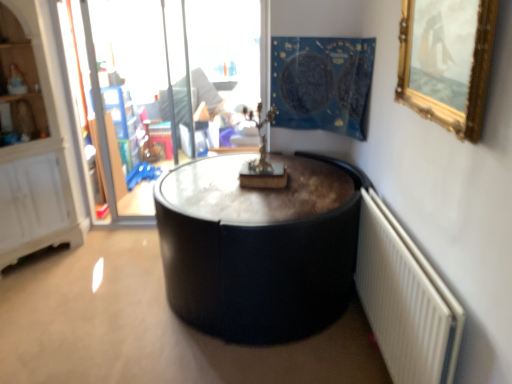
Identify the location of white textured radiator at lower right. The height and width of the screenshot is (384, 512). (405, 300).

In order to click on transparent glass door at upper left in this screenshot , I will do `click(178, 61)`.

Locate an element on the screen. This screenshot has height=384, width=512. white textured radiator at lower right is located at coordinates (405, 300).

From the image's perspective, does transparent glass door at upper left appear higher than white textured radiator at lower right?

Indeed, from the image's perspective, transparent glass door at upper left is shown above white textured radiator at lower right.

In the image, is transparent glass door at upper left on the left side or the right side of white textured radiator at lower right?

transparent glass door at upper left is positioned on white textured radiator at lower right's left side.

From a real-world perspective, which object stands above the other?

transparent glass door at upper left, from a real-world perspective.

Which of these two, blue fabric tapestry at upper center or gold-framed mirror at upper right, is smaller?

gold-framed mirror at upper right is smaller.

Is blue fabric tapestry at upper center facing away from gold-framed mirror at upper right?

No, blue fabric tapestry at upper center is not facing away from gold-framed mirror at upper right.

Does blue fabric tapestry at upper center have a greater height compared to gold-framed mirror at upper right?

Yes.

Could you tell me if white textured radiator at lower right is facing blue fabric tapestry at upper center?

No, white textured radiator at lower right is not turned towards blue fabric tapestry at upper center.

Is point (377, 252) positioned after point (283, 77)?

No, it is in front of (283, 77).

From a real-world perspective, is white textured radiator at lower right under blue fabric tapestry at upper center?

Yes, from a real-world perspective, white textured radiator at lower right is below blue fabric tapestry at upper center.

Does white textured radiator at lower right have a larger size compared to blue fabric tapestry at upper center?

No, white textured radiator at lower right is not bigger than blue fabric tapestry at upper center.

Between gold-framed mirror at upper right and white textured radiator at lower right, which one has less height?

With less height is gold-framed mirror at upper right.

Is gold-framed mirror at upper right to the left of white textured radiator at lower right from the viewer's perspective?

No, gold-framed mirror at upper right is not to the left of white textured radiator at lower right.

Is gold-framed mirror at upper right turned away from white textured radiator at lower right?

No, white textured radiator at lower right is not at the back of gold-framed mirror at upper right.

Choose the correct answer: Is transparent glass door at upper left inside blue fabric tapestry at upper center or outside it?

transparent glass door at upper left is located beyond the bounds of blue fabric tapestry at upper center.

Considering the relative sizes of transparent glass door at upper left and blue fabric tapestry at upper center in the image provided, is transparent glass door at upper left thinner than blue fabric tapestry at upper center?

Correct, the width of transparent glass door at upper left is less than that of blue fabric tapestry at upper center.

From the image's perspective, which one is positioned lower, transparent glass door at upper left or blue fabric tapestry at upper center?

transparent glass door at upper left, from the image's perspective.

Could you tell me if transparent glass door at upper left is facing blue fabric tapestry at upper center?

No, transparent glass door at upper left is not oriented towards blue fabric tapestry at upper center.

Considering their positions, is white textured radiator at lower right located in front of or behind transparent glass door at upper left?

Clearly, white textured radiator at lower right is in front of transparent glass door at upper left.

Is white textured radiator at lower right far from transparent glass door at upper left?

Yes, white textured radiator at lower right and transparent glass door at upper left are quite far apart.

From a real-world perspective, is white textured radiator at lower right above or below transparent glass door at upper left?

white textured radiator at lower right is situated lower than transparent glass door at upper left in the real world.

Can you confirm if white textured radiator at lower right is thinner than transparent glass door at upper left?

Yes, white textured radiator at lower right is thinner than transparent glass door at upper left.

From the image's perspective, between blue fabric tapestry at upper center and white textured radiator at lower right, who is located below?

white textured radiator at lower right.

From a real-world perspective, is blue fabric tapestry at upper center above or below white textured radiator at lower right?

Clearly, from a real-world perspective, blue fabric tapestry at upper center is above white textured radiator at lower right.

Does blue fabric tapestry at upper center lie in front of white textured radiator at lower right?

No, blue fabric tapestry at upper center is further to the viewer.

Is blue fabric tapestry at upper center wider or thinner than white textured radiator at lower right?

blue fabric tapestry at upper center is wider than white textured radiator at lower right.

This screenshot has height=384, width=512. I want to click on radiator located in front of the transparent glass door at upper left, so click(405, 300).

Where is `picture frame above the blue fabric tapestry at upper center (from a real-world perspective)`? picture frame above the blue fabric tapestry at upper center (from a real-world perspective) is located at coordinates (447, 63).

Consider the image. Looking at the image, which one is located further to white textured radiator at lower right, gold-framed mirror at upper right or transparent glass door at upper left?

Among the two, transparent glass door at upper left is located further to white textured radiator at lower right.

From the image, which object appears to be farther from gold-framed mirror at upper right, blue fabric tapestry at upper center or transparent glass door at upper left?

The object further to gold-framed mirror at upper right is transparent glass door at upper left.

Looking at the image, which one is located further to gold-framed mirror at upper right, transparent glass door at upper left or blue fabric tapestry at upper center?

Based on the image, transparent glass door at upper left appears to be further to gold-framed mirror at upper right.

Looking at the image, which one is located closer to blue fabric tapestry at upper center, white textured radiator at lower right or transparent glass door at upper left?

transparent glass door at upper left is positioned closer to the anchor blue fabric tapestry at upper center.

Which object lies nearer to the anchor point transparent glass door at upper left, gold-framed mirror at upper right or blue fabric tapestry at upper center?

blue fabric tapestry at upper center is closer to transparent glass door at upper left.

Looking at the image, which one is located closer to white textured radiator at lower right, blue fabric tapestry at upper center or transparent glass door at upper left?

Based on the image, blue fabric tapestry at upper center appears to be nearer to white textured radiator at lower right.

Based on the photo, from the image, which object appears to be nearer to blue fabric tapestry at upper center, gold-framed mirror at upper right or white textured radiator at lower right?

Based on the image, gold-framed mirror at upper right appears to be nearer to blue fabric tapestry at upper center.

Based on their spatial positions, is white textured radiator at lower right or transparent glass door at upper left further from gold-framed mirror at upper right?

transparent glass door at upper left lies further to gold-framed mirror at upper right than the other object.

At what (x,y) coordinates should I click in order to perform the action: click on tapestry between gold-framed mirror at upper right and transparent glass door at upper left from front to back. Please return your answer as a coordinate pair (x, y). The width and height of the screenshot is (512, 384). Looking at the image, I should click on (322, 83).

This screenshot has width=512, height=384. Find the location of `tapestry between white textured radiator at lower right and transparent glass door at upper left in the front-back direction`. tapestry between white textured radiator at lower right and transparent glass door at upper left in the front-back direction is located at coordinates (322, 83).

Where is `radiator positioned between gold-framed mirror at upper right and blue fabric tapestry at upper center from near to far`? The height and width of the screenshot is (384, 512). radiator positioned between gold-framed mirror at upper right and blue fabric tapestry at upper center from near to far is located at coordinates (405, 300).

Locate an element on the screen. Image resolution: width=512 pixels, height=384 pixels. radiator positioned between gold-framed mirror at upper right and transparent glass door at upper left from near to far is located at coordinates (405, 300).